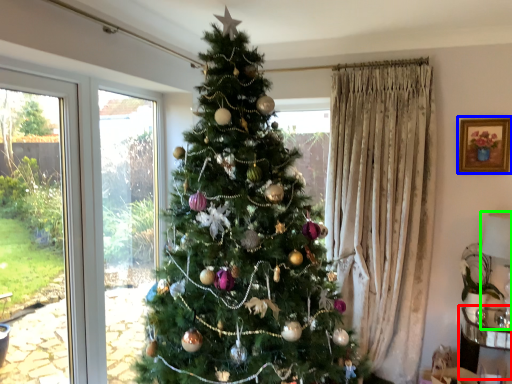
Question: Which is nearer to the furniture (highlighted by a red box)? picture frame (highlighted by a blue box) or lamp (highlighted by a green box).

Choices:
 (A) picture frame
 (B) lamp

Answer: (B)